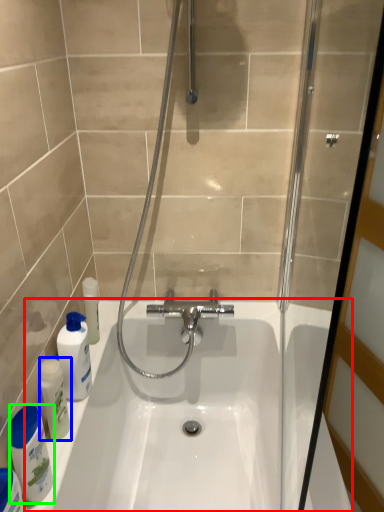
Question: Which object is positioned closest to bath (highlighted by a red box)? Select from cleaning product (highlighted by a blue box) and cleaning product (highlighted by a green box).

Choices:
 (A) cleaning product
 (B) cleaning product

Answer: (A)